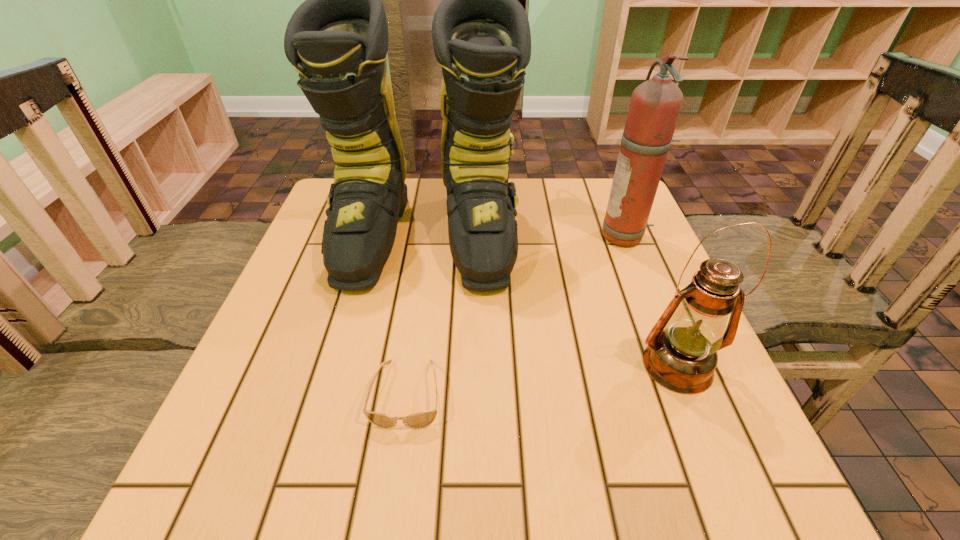
Locate an element on the screen. fire extinguisher located at the far edge is located at coordinates (655, 105).

I want to click on object at the left edge, so pyautogui.click(x=337, y=40).

Find the location of a particular element. The width and height of the screenshot is (960, 540). fire extinguisher positioned at the right edge is located at coordinates coord(655,105).

Find the location of a particular element. The image size is (960, 540). oil lamp at the right edge is located at coordinates (681, 355).

Identify the location of object at the far left corner. The height and width of the screenshot is (540, 960). (337, 40).

Locate an element on the screen. This screenshot has width=960, height=540. object that is positioned at the far right corner is located at coordinates (655, 105).

The width and height of the screenshot is (960, 540). Identify the location of free region at the far edge. (531, 218).

In the image, there is a desktop. Where is `vacant space at the near edge`? vacant space at the near edge is located at coordinates (510, 478).

In the image, there is a desktop. Identify the location of vacant area at the left edge. (269, 430).

Identify the location of vacant space at the right edge of the desktop. (648, 313).